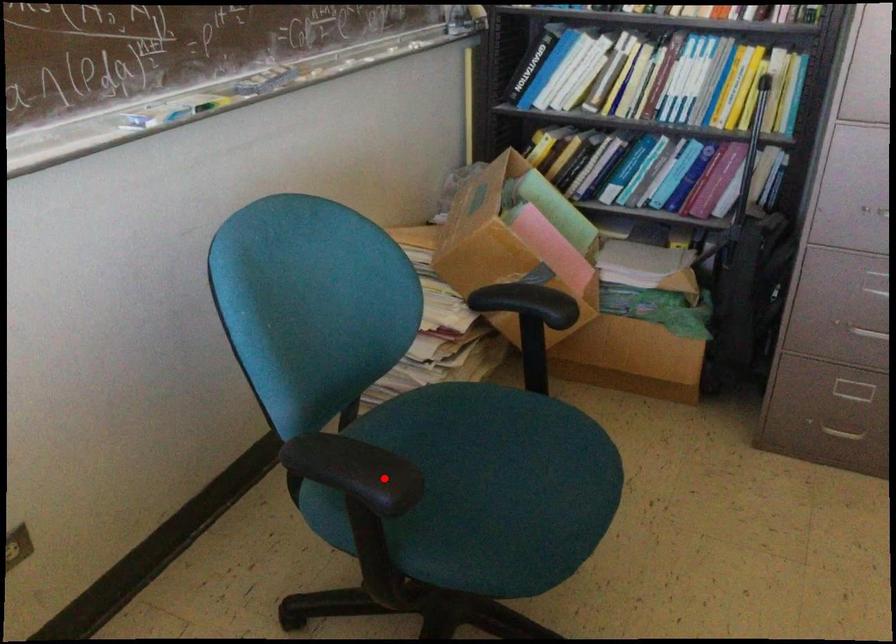
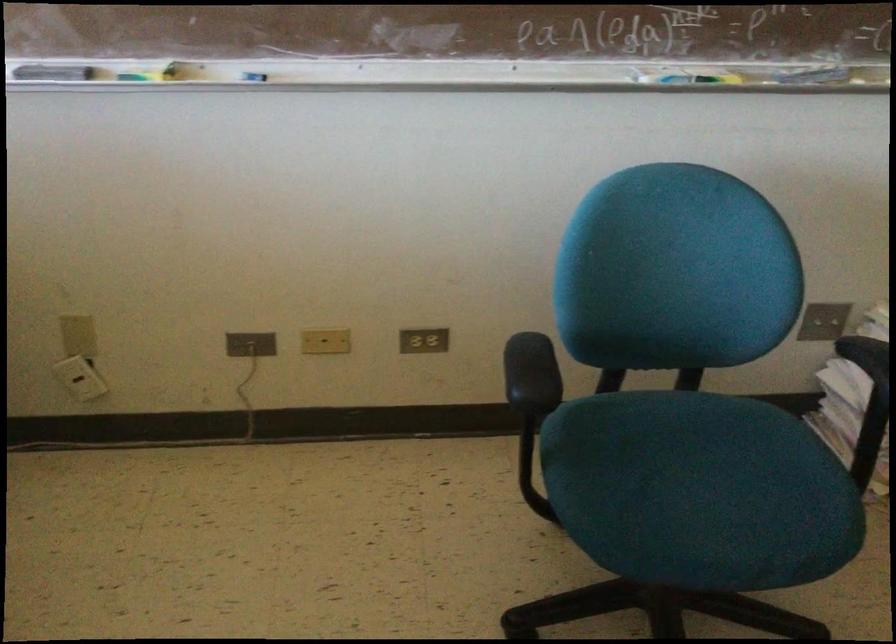
Question: I am providing you with two images of the same scene from different viewpoints. Image1 has a red point marked. In image2, the corresponding 3D location appears at what relative position? Reply with the corresponding letter.

Choices:
 (A) Closer
 (B) Farther

Answer: (B)